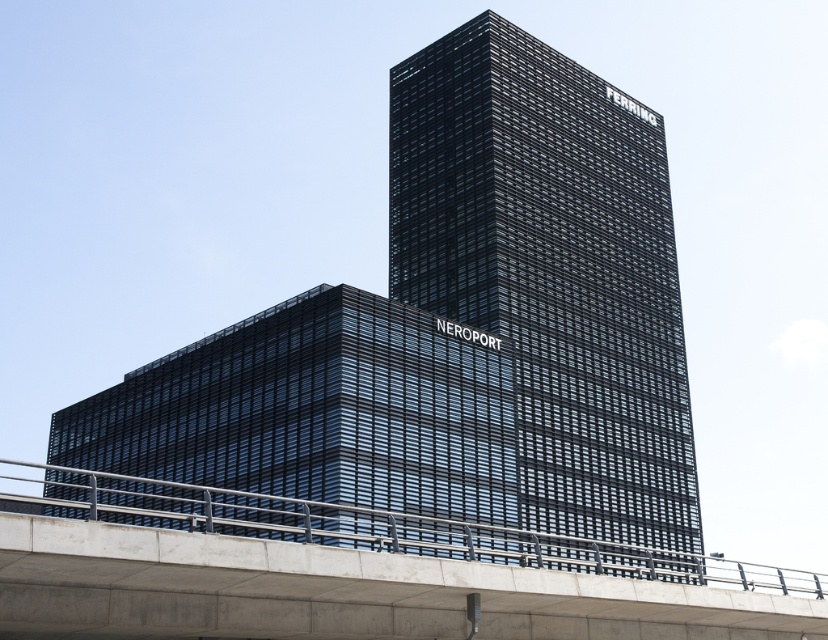
You are a city planner analyzing the layout of this area. You need to determine the spatial relationship between the black glass building at center and the concrete bridge at lower center. Which object is located to the right of the other?

The black glass building at center is positioned on the right side of concrete bridge at lower center, meaning it is to the right of the bridge.

You are standing at the entrance of the building complex and want to locate the black glass building at center. According to the coordinates provided, where exactly is it positioned?

The black glass building at center is positioned at coordinates point (552, 269).

You are standing on the sidewalk in front of the black glass building at center and want to cross the street to reach the concrete bridge at lower center. Which object is closer to you as you start crossing the street?

The black glass building at center is closer to you than the concrete bridge at lower center because it is further to the viewer than the concrete bridge at lower center.